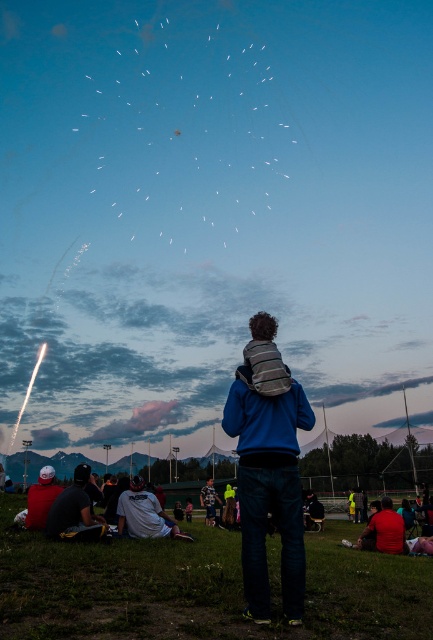
Question: Considering the relative positions of blue fleece jacket at center and matte white cap at lower left in the image provided, where is blue fleece jacket at center located with respect to matte white cap at lower left?

Choices:
 (A) right
 (B) left

Answer: (A)

Question: Is green grass at lower center below blue jersey at center?

Choices:
 (A) yes
 (B) no

Answer: (B)

Question: Is blue fleece jacket at center wider than matte white cap at lower left?

Choices:
 (A) no
 (B) yes

Answer: (A)

Question: Which object appears closest to the camera in this image?

Choices:
 (A) dark blue shirt at lower left
 (B) white cotton shirt at lower center
 (C) blue fleece jacket at center
 (D) matte white cap at lower left

Answer: (C)

Question: Among these points, which one is nearest to the camera?

Choices:
 (A) (216, 499)
 (B) (290, 477)
 (C) (123, 177)
 (D) (84, 465)

Answer: (B)

Question: Which object is the farthest from the red fabric shirt at lower right?

Choices:
 (A) matte white cap at lower left
 (B) white cotton shirt at lower center

Answer: (A)